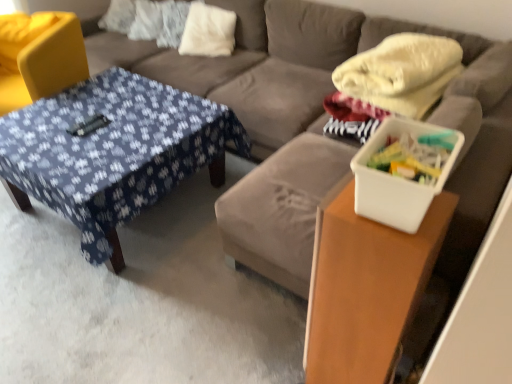
Question: Can you confirm if white soft pillow at upper center is thinner than blue fabric-covered table at center, which is the 2th table in front-to-back order?

Choices:
 (A) no
 (B) yes

Answer: (B)

Question: Can you confirm if white soft pillow at upper center is shorter than blue fabric-covered table at center, acting as the first table starting from the left?

Choices:
 (A) yes
 (B) no

Answer: (B)

Question: Is white soft pillow at upper center wider than blue fabric-covered table at center, acting as the first table starting from the left?

Choices:
 (A) yes
 (B) no

Answer: (B)

Question: Considering the relative sizes of white soft pillow at upper center and blue fabric-covered table at center, placed as the 1th table when sorted from back to front, in the image provided, is white soft pillow at upper center taller than blue fabric-covered table at center, placed as the 1th table when sorted from back to front,?

Choices:
 (A) no
 (B) yes

Answer: (B)

Question: Is white soft pillow at upper center far away from blue fabric-covered table at center, acting as the first table starting from the left?

Choices:
 (A) no
 (B) yes

Answer: (B)

Question: Is white soft pillow at upper center at the right side of blue fabric-covered table at center, which is the 2th table in front-to-back order?

Choices:
 (A) yes
 (B) no

Answer: (A)

Question: From a real-world perspective, is white plastic container at right under blue fabric-covered table at center, placed as the 1th table when sorted from back to front?

Choices:
 (A) no
 (B) yes

Answer: (A)

Question: Is white plastic container at right positioned beyond the bounds of blue fabric-covered table at center, placed as the 1th table when sorted from back to front?

Choices:
 (A) no
 (B) yes

Answer: (B)

Question: Does white plastic container at right have a lesser height compared to blue fabric-covered table at center, which is the 2th table in front-to-back order?

Choices:
 (A) yes
 (B) no

Answer: (A)

Question: From the image's perspective, would you say white plastic container at right is positioned over blue fabric-covered table at center, acting as the first table starting from the left?

Choices:
 (A) no
 (B) yes

Answer: (A)

Question: Does white plastic container at right have a smaller size compared to blue fabric-covered table at center, acting as the first table starting from the left?

Choices:
 (A) no
 (B) yes

Answer: (B)

Question: Can you confirm if white plastic container at right is bigger than blue fabric-covered table at center, marked as the 2th table in a right-to-left arrangement?

Choices:
 (A) no
 (B) yes

Answer: (A)

Question: From a real-world perspective, is white plastic container at right under white soft pillow at upper center?

Choices:
 (A) yes
 (B) no

Answer: (B)